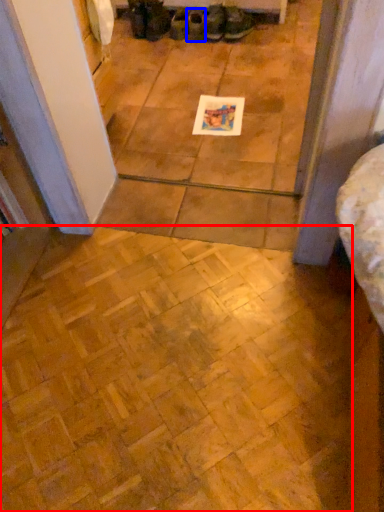
Question: Among these objects, which one is farthest to the camera, ceramic tile (highlighted by a red box) or footwear (highlighted by a blue box)?

Choices:
 (A) ceramic tile
 (B) footwear

Answer: (B)